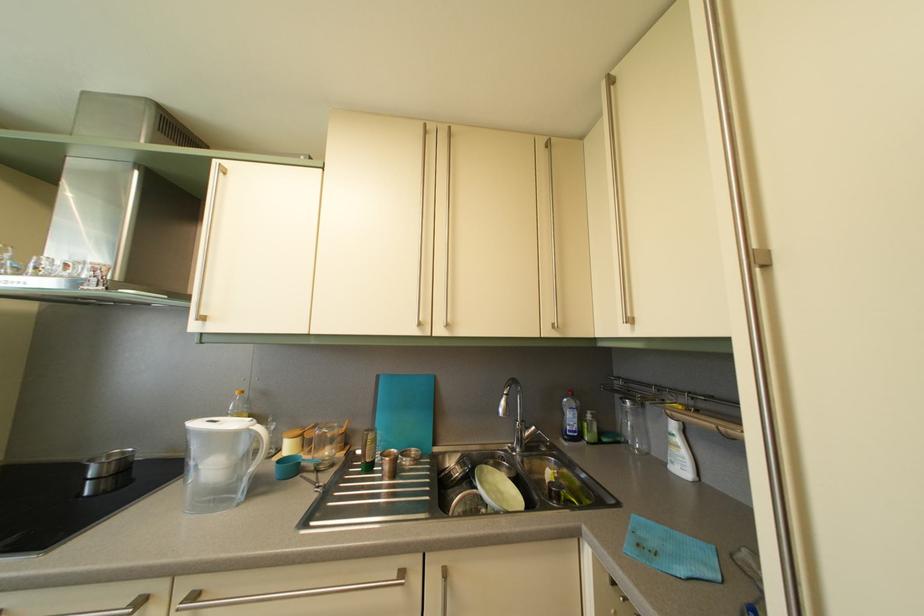
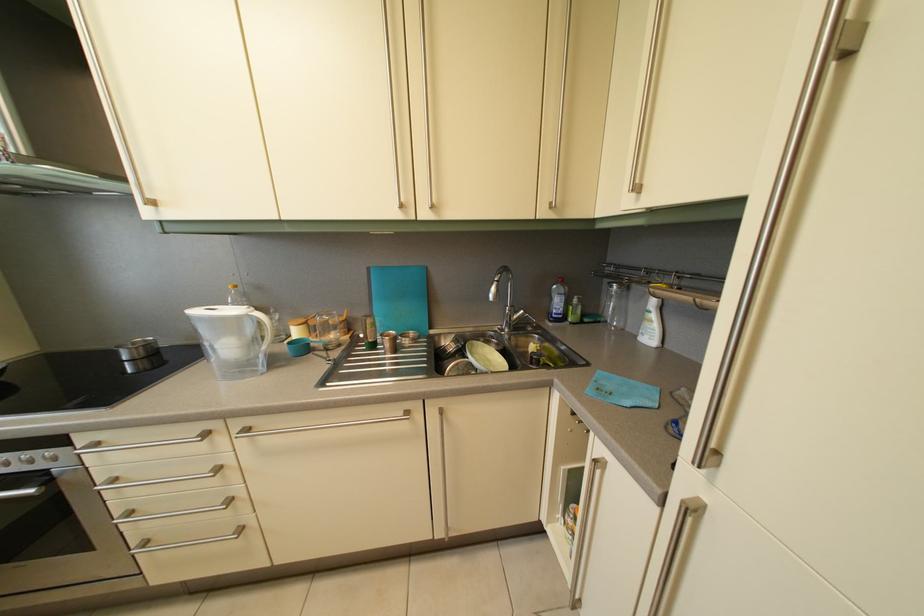
Question: The images are taken continuously from a first-person perspective. In which direction is your viewpoint rotating?

Choices:
 (A) Left
 (B) Right
 (C) Up
 (D) Down

Answer: (D)